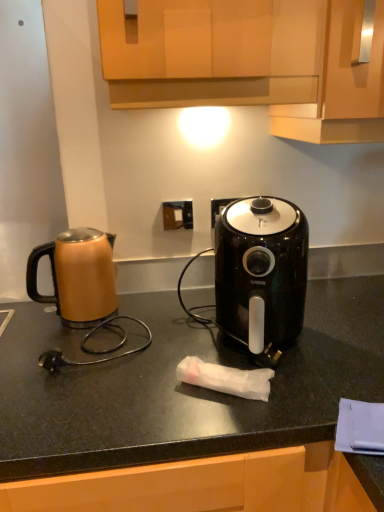
The image size is (384, 512). What do you see at coordinates (178, 215) in the screenshot?
I see `white plastic electric outlet at center` at bounding box center [178, 215].

The image size is (384, 512). Describe the element at coordinates (78, 276) in the screenshot. I see `matte brown kettle at left` at that location.

What are the coordinates of `black glossy air fryer at center` in the screenshot? It's located at (261, 274).

Describe the element at coordinates (261, 274) in the screenshot. The height and width of the screenshot is (512, 384). I see `black glossy air fryer at center` at that location.

The width and height of the screenshot is (384, 512). Describe the element at coordinates (184, 387) in the screenshot. I see `black matte countertop at center` at that location.

Find the location of a particular element. wooden cabinet at upper center, which appears as the first cabinetry when viewed from the right is located at coordinates point(341,85).

Is white plastic electric outlet at center inside or outside of matte brown kettle at left?

white plastic electric outlet at center cannot be found inside matte brown kettle at left.

In order to click on electric outlet above the matte brown kettle at left (from a real-world perspective) in this screenshot , I will do `click(178, 215)`.

Would you consider white plastic electric outlet at center to be distant from matte brown kettle at left?

No, white plastic electric outlet at center is not far from matte brown kettle at left.

Considering the relative positions of white plastic electric outlet at center and matte brown kettle at left in the image provided, is white plastic electric outlet at center to the right of matte brown kettle at left from the viewer's perspective?

Correct, you'll find white plastic electric outlet at center to the right of matte brown kettle at left.

From a real-world perspective, between white plastic electric outlet at center and black matte countertop at center, who is vertically lower?

In real-world perspective, black matte countertop at center is lower.

Which of these two, white plastic electric outlet at center or black matte countertop at center, is bigger?

With larger size is black matte countertop at center.

Is white plastic electric outlet at center to the right of black matte countertop at center from the viewer's perspective?

No.

Considering the sizes of objects white plastic electric outlet at center and black matte countertop at center in the image provided, who is wider, white plastic electric outlet at center or black matte countertop at center?

black matte countertop at center.

Considering the sizes of black matte countertop at center and matte brown kettle at left in the image, is black matte countertop at center wider or thinner than matte brown kettle at left?

Clearly, black matte countertop at center has more width compared to matte brown kettle at left.

Locate an element on the screen. This screenshot has height=512, width=384. countertop lying in front of the matte brown kettle at left is located at coordinates (184, 387).

In the scene shown: Which is more to the right, black matte countertop at center or matte brown kettle at left?

black matte countertop at center.

Are black matte countertop at center and matte brown kettle at left beside each other?

No, black matte countertop at center is not next to matte brown kettle at left.

Does wooden cabinet at upper center, arranged as the 1th cabinetry when viewed from the left, contain white plastic electric outlet at center?

No, white plastic electric outlet at center is located outside of wooden cabinet at upper center, arranged as the 1th cabinetry when viewed from the left.

From a real-world perspective, is wooden cabinet at upper center, arranged as the second cabinetry when viewed from the right, positioned over white plastic electric outlet at center based on gravity?

Correct, in the physical world, wooden cabinet at upper center, arranged as the second cabinetry when viewed from the right, is higher than white plastic electric outlet at center.

Does wooden cabinet at upper center, arranged as the 1th cabinetry when viewed from the left, have a greater height compared to white plastic electric outlet at center?

Correct, wooden cabinet at upper center, arranged as the 1th cabinetry when viewed from the left, is much taller as white plastic electric outlet at center.

Can you confirm if wooden cabinet at upper center, arranged as the 1th cabinetry when viewed from the left, is bigger than white plastic electric outlet at center?

Yes.

Relative to black glossy air fryer at center, is wooden cabinet at upper center, arranged as the 1th cabinetry when viewed from the left, in front or behind?

In the image, wooden cabinet at upper center, arranged as the 1th cabinetry when viewed from the left, appears in front of black glossy air fryer at center.

Is wooden cabinet at upper center, arranged as the 1th cabinetry when viewed from the left, directly adjacent to black glossy air fryer at center?

wooden cabinet at upper center, arranged as the 1th cabinetry when viewed from the left, and black glossy air fryer at center are not in contact.

From the image's perspective, is wooden cabinet at upper center, arranged as the second cabinetry when viewed from the right, beneath black glossy air fryer at center?

Actually, wooden cabinet at upper center, arranged as the second cabinetry when viewed from the right, appears above black glossy air fryer at center in the image.

Based on the photo, is wooden cabinet at upper center, which appears as the first cabinetry when viewed from the right, thinner than black glossy air fryer at center?

In fact, wooden cabinet at upper center, which appears as the first cabinetry when viewed from the right, might be wider than black glossy air fryer at center.

From the picture: From a real-world perspective, is wooden cabinet at upper center, which appears as the first cabinetry when viewed from the right, positioned over black glossy air fryer at center based on gravity?

Yes, from a real-world perspective, wooden cabinet at upper center, which appears as the first cabinetry when viewed from the right, is on top of black glossy air fryer at center.

You are a GUI agent. You are given a task and a screenshot of the screen. Output one action in this format:
    pyautogui.click(x=<x>, y=<y>)
    Task: Click on the toaster that appears below the wooden cabinet at upper center, which appears as the first cabinetry when viewed from the right (from a real-world perspective)
    Image resolution: width=384 pixels, height=512 pixels.
    Given the screenshot: What is the action you would take?
    [261, 274]

Considering their positions, is black matte countertop at center located in front of or behind white plastic electric outlet at center?

Clearly, black matte countertop at center is in front of white plastic electric outlet at center.

Is black matte countertop at center surrounding white plastic electric outlet at center?

That's incorrect, white plastic electric outlet at center is not inside black matte countertop at center.

Is black matte countertop at center turned away from white plastic electric outlet at center?

No.

Identify the location of electric outlet above the matte brown kettle at left (from a real-world perspective). The image size is (384, 512). (178, 215).

This screenshot has width=384, height=512. Identify the location of electric outlet behind the black matte countertop at center. (178, 215).

From the image, which object appears to be farther from wooden cabinet at upper center, which appears as the first cabinetry when viewed from the right, matte brown kettle at left or black matte countertop at center?

Based on the image, matte brown kettle at left appears to be further to wooden cabinet at upper center, which appears as the first cabinetry when viewed from the right.

Estimate the real-world distances between objects in this image. Which object is closer to black glossy air fryer at center, white plastic electric outlet at center or wooden cabinet at upper center, which appears as the first cabinetry when viewed from the right?

The object closer to black glossy air fryer at center is wooden cabinet at upper center, which appears as the first cabinetry when viewed from the right.

When comparing their distances from matte brown kettle at left, does black matte countertop at center or black glossy air fryer at center seem closer?

The object closer to matte brown kettle at left is black matte countertop at center.

Consider the image. Based on their spatial positions, is wooden cabinet at upper center, arranged as the second cabinetry when viewed from the right, or wooden cabinet at upper center, which appears as the first cabinetry when viewed from the right, closer to black matte countertop at center?

Based on the image, wooden cabinet at upper center, which appears as the first cabinetry when viewed from the right, appears to be nearer to black matte countertop at center.

From the image, which object appears to be nearer to white plastic electric outlet at center, black glossy air fryer at center or black matte countertop at center?

black glossy air fryer at center lies closer to white plastic electric outlet at center than the other object.

In the scene shown: Estimate the real-world distances between objects in this image. Which object is closer to black glossy air fryer at center, matte brown kettle at left or black matte countertop at center?

The object closer to black glossy air fryer at center is black matte countertop at center.

From the image, which object appears to be nearer to black matte countertop at center, white plastic electric outlet at center or matte brown kettle at left?

matte brown kettle at left.

From the image, which object appears to be farther from white plastic electric outlet at center, wooden cabinet at upper center, arranged as the second cabinetry when viewed from the right, or black glossy air fryer at center?

Based on the image, wooden cabinet at upper center, arranged as the second cabinetry when viewed from the right, appears to be further to white plastic electric outlet at center.

Find the location of a particular element. kettle between wooden cabinet at upper center, arranged as the second cabinetry when viewed from the right, and black glossy air fryer at center from top to bottom is located at coordinates (78, 276).

The height and width of the screenshot is (512, 384). In order to click on electric outlet between wooden cabinet at upper center, arranged as the 1th cabinetry when viewed from the left, and black matte countertop at center from top to bottom in this screenshot , I will do (x=178, y=215).

Where is `electric outlet between matte brown kettle at left and wooden cabinet at upper center, which appears as the first cabinetry when viewed from the right`? electric outlet between matte brown kettle at left and wooden cabinet at upper center, which appears as the first cabinetry when viewed from the right is located at coordinates (178, 215).

This screenshot has height=512, width=384. I want to click on toaster between matte brown kettle at left and wooden cabinet at upper center, the second cabinetry from the left, from left to right, so click(261, 274).